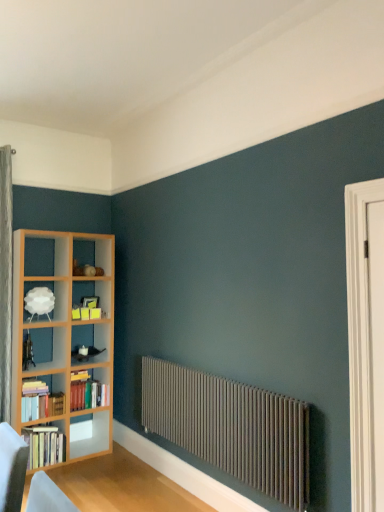
The image size is (384, 512). Identify the location of vacant area that is situated to the right of hardcover books at left, positioned as the 1th book in bottom-to-top order. (74, 464).